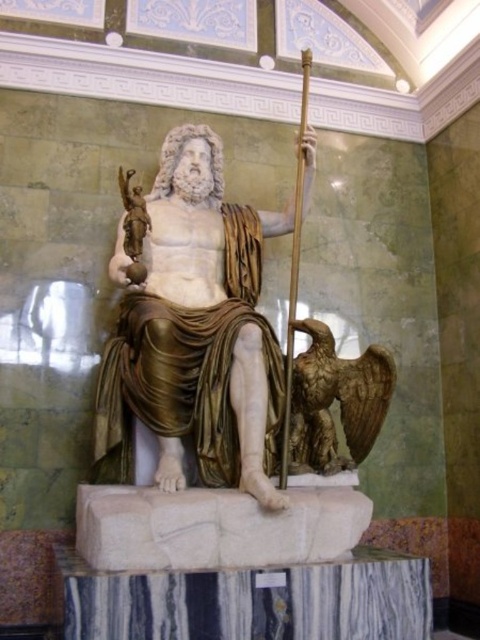
Question: Which point appears closest to the camera in this image?

Choices:
 (A) (382, 356)
 (B) (235, 376)

Answer: (B)

Question: Does white marble statue at center have a greater width compared to bronze eagle at lower right?

Choices:
 (A) no
 (B) yes

Answer: (B)

Question: Observing the image, what is the correct spatial positioning of white marble statue at center in reference to bronze eagle at lower right?

Choices:
 (A) right
 (B) left

Answer: (B)

Question: Is white marble statue at center to the left of bronze eagle at lower right from the viewer's perspective?

Choices:
 (A) no
 (B) yes

Answer: (B)

Question: Which of the following is the closest to the observer?

Choices:
 (A) white marble statue at center
 (B) bronze eagle at lower right

Answer: (A)